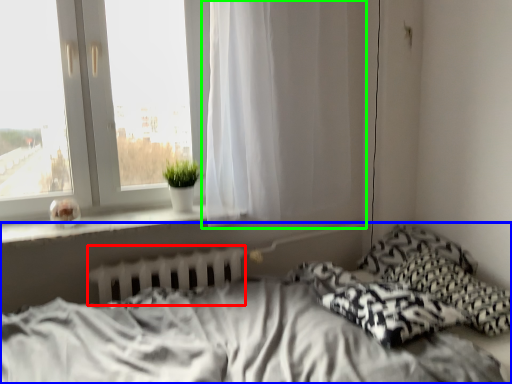
Question: Which is nearer to the radiator (highlighted by a red box)? bed (highlighted by a blue box) or curtain (highlighted by a green box).

Choices:
 (A) bed
 (B) curtain

Answer: (A)